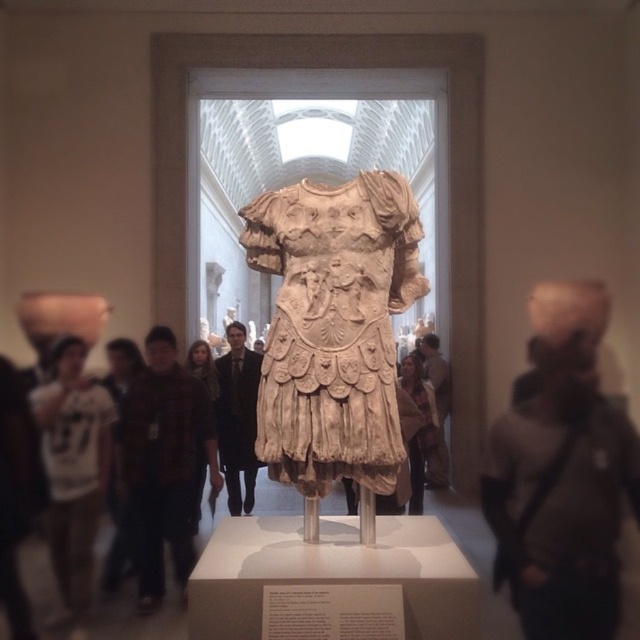
Question: Can you confirm if matte gray shirt at center is positioned below light brown leather jacket at center?

Choices:
 (A) yes
 (B) no

Answer: (A)

Question: Considering the real-world distances, which object is farthest from the light brown leather jacket at center?

Choices:
 (A) black suit at center
 (B) brown wool scarf at center
 (C) matte gray shirt at center

Answer: (B)

Question: Can you confirm if beige stone armor at center is positioned below brown wool scarf at center?

Choices:
 (A) yes
 (B) no

Answer: (B)

Question: Which object is closer to the camera taking this photo?

Choices:
 (A) brown wool scarf at center
 (B) black suit at center
 (C) matte gray shirt at center
 (D) brown wool sweater at center

Answer: (C)

Question: Can you confirm if matte gray shirt at center is positioned below black suit at center?

Choices:
 (A) yes
 (B) no

Answer: (A)

Question: Estimate the real-world distances between objects in this image. Which object is closer to the matte gray shirt at center?

Choices:
 (A) light brown leather jacket at center
 (B) white cotton shirt at lower left

Answer: (A)